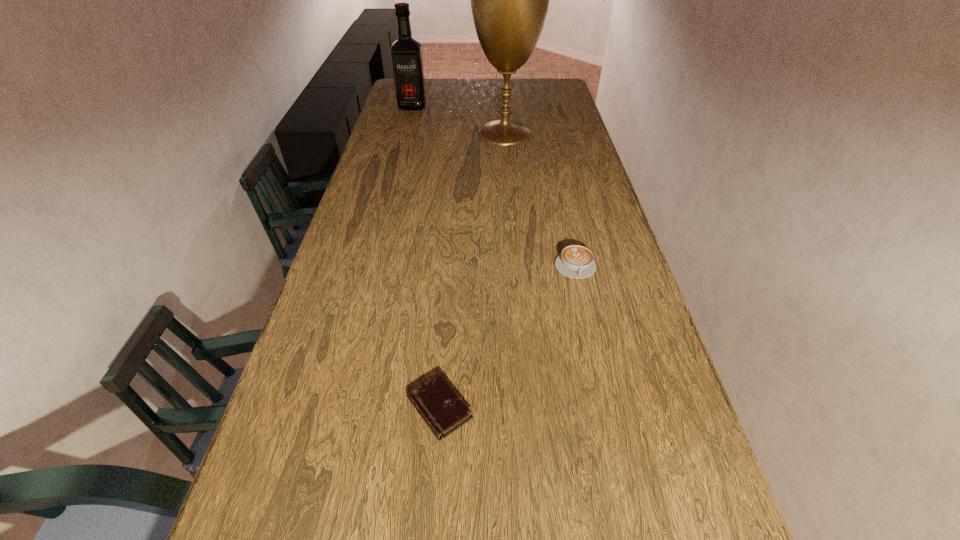
This screenshot has width=960, height=540. Find the location of `free space in the image that satisfies the following two spatial constraints: 1. on the front-facing side of the trophy cup; 2. on the right side of the liquor`. free space in the image that satisfies the following two spatial constraints: 1. on the front-facing side of the trophy cup; 2. on the right side of the liquor is located at coordinates (405, 133).

I want to click on vacant space that satisfies the following two spatial constraints: 1. on the front-facing side of the nearest object; 2. on the left side of the second tallest object, so click(x=332, y=408).

Find the location of a particular element. This screenshot has height=540, width=960. vacant space that satisfies the following two spatial constraints: 1. on the front-facing side of the farthest object; 2. on the right side of the diary is located at coordinates (332, 408).